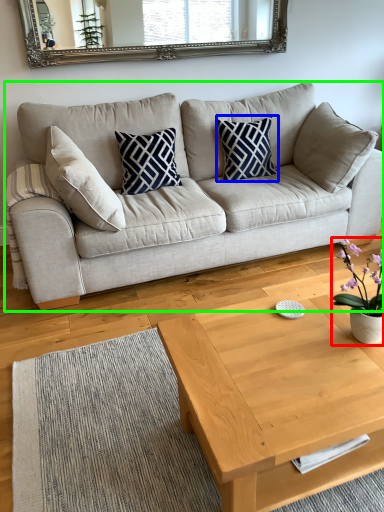
Question: Which is farther away from houseplant (highlighted by a red box)? pillow (highlighted by a blue box) or studio couch (highlighted by a green box)?

Choices:
 (A) pillow
 (B) studio couch

Answer: (A)